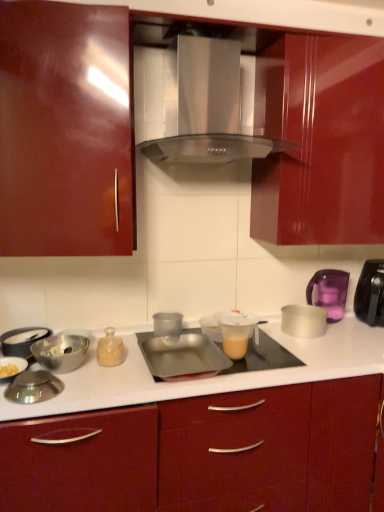
Question: From a real-world perspective, does satin silver range hood at center stand above metallic silver bowl at lower left, which appears as the 2th appliance when viewed from the left?

Choices:
 (A) yes
 (B) no

Answer: (A)

Question: Considering the relative sizes of satin silver range hood at center and metallic silver bowl at lower left, which is the 7th appliance from right to left, in the image provided, is satin silver range hood at center thinner than metallic silver bowl at lower left, which is the 7th appliance from right to left,?

Choices:
 (A) yes
 (B) no

Answer: (B)

Question: Is satin silver range hood at center at the right side of metallic silver bowl at lower left, which is the 7th appliance from right to left?

Choices:
 (A) no
 (B) yes

Answer: (B)

Question: Can you confirm if satin silver range hood at center is taller than metallic silver bowl at lower left, which is the 7th appliance from right to left?

Choices:
 (A) no
 (B) yes

Answer: (B)

Question: Is satin silver range hood at center located outside metallic silver bowl at lower left, which appears as the 2th appliance when viewed from the left?

Choices:
 (A) no
 (B) yes

Answer: (B)

Question: Is satin silver range hood at center facing towards metallic silver bowl at lower left, which appears as the 2th appliance when viewed from the left?

Choices:
 (A) yes
 (B) no

Answer: (B)

Question: Is metallic silver pan at left, arranged as the 8th appliance when viewed from the right, facing towards shiny silver lid at lower left, the third appliance in the left-to-right sequence?

Choices:
 (A) no
 (B) yes

Answer: (B)

Question: Considering the relative sizes of metallic silver pan at left, arranged as the 8th appliance when viewed from the right, and shiny silver lid at lower left, the third appliance in the left-to-right sequence, in the image provided, is metallic silver pan at left, arranged as the 8th appliance when viewed from the right, taller than shiny silver lid at lower left, the third appliance in the left-to-right sequence,?

Choices:
 (A) no
 (B) yes

Answer: (B)

Question: From a real-world perspective, is metallic silver pan at left, arranged as the first appliance when viewed from the left, located higher than shiny silver lid at lower left, the third appliance in the left-to-right sequence?

Choices:
 (A) no
 (B) yes

Answer: (B)

Question: Are metallic silver pan at left, arranged as the first appliance when viewed from the left, and shiny silver lid at lower left, the third appliance in the left-to-right sequence, located far from each other?

Choices:
 (A) no
 (B) yes

Answer: (A)

Question: From the image's perspective, does metallic silver pan at left, arranged as the first appliance when viewed from the left, appear higher than shiny silver lid at lower left, positioned as the 6th appliance in right-to-left order?

Choices:
 (A) yes
 (B) no

Answer: (A)

Question: Is metallic silver pan at left, arranged as the first appliance when viewed from the left, beside shiny silver lid at lower left, positioned as the 6th appliance in right-to-left order?

Choices:
 (A) no
 (B) yes

Answer: (A)

Question: Considering the relative sizes of metallic silver pan at left, arranged as the 8th appliance when viewed from the right, and satin silver range hood at center in the image provided, is metallic silver pan at left, arranged as the 8th appliance when viewed from the right, smaller than satin silver range hood at center?

Choices:
 (A) yes
 (B) no

Answer: (A)